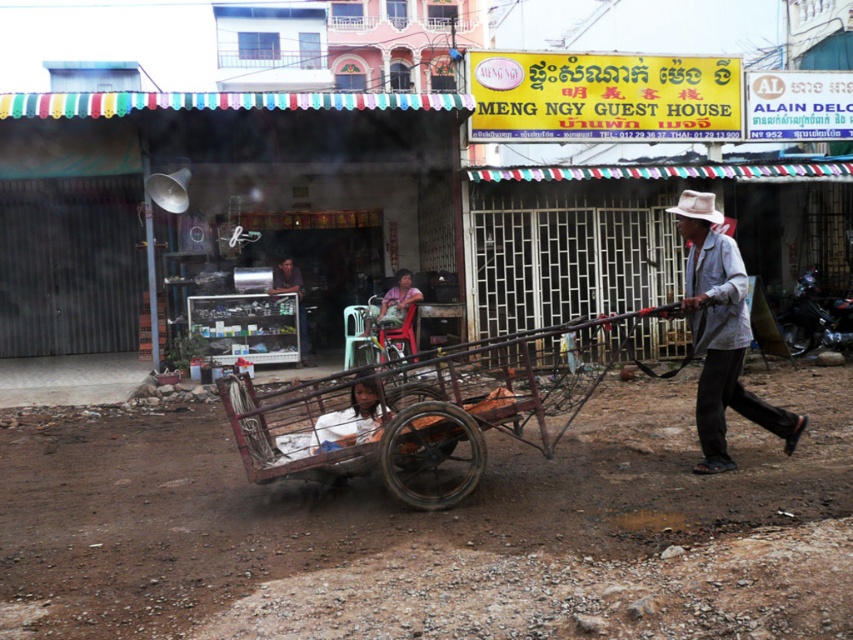
Question: Considering the relative positions of light brown fabric hat at right and matte brown cart at center in the image provided, where is light brown fabric hat at right located with respect to matte brown cart at center?

Choices:
 (A) left
 (B) right

Answer: (B)

Question: Which object is positioned farthest from the matte brown cart at center?

Choices:
 (A) rusty metal cart at center
 (B) dark gray metal cart at center

Answer: (A)

Question: Which point is closer to the camera?

Choices:
 (A) (169, 160)
 (B) (273, 291)

Answer: (A)

Question: Which point is farther from the camera taking this photo?

Choices:
 (A) pos(688,204)
 (B) pos(271,292)
 (C) pos(386,300)
 (D) pos(12,333)

Answer: (D)

Question: Is brown dirt field at lower center below metallic grill at center?

Choices:
 (A) no
 (B) yes

Answer: (B)

Question: Can you confirm if brown dirt field at lower center is thinner than rusty metal cart at center?

Choices:
 (A) no
 (B) yes

Answer: (B)